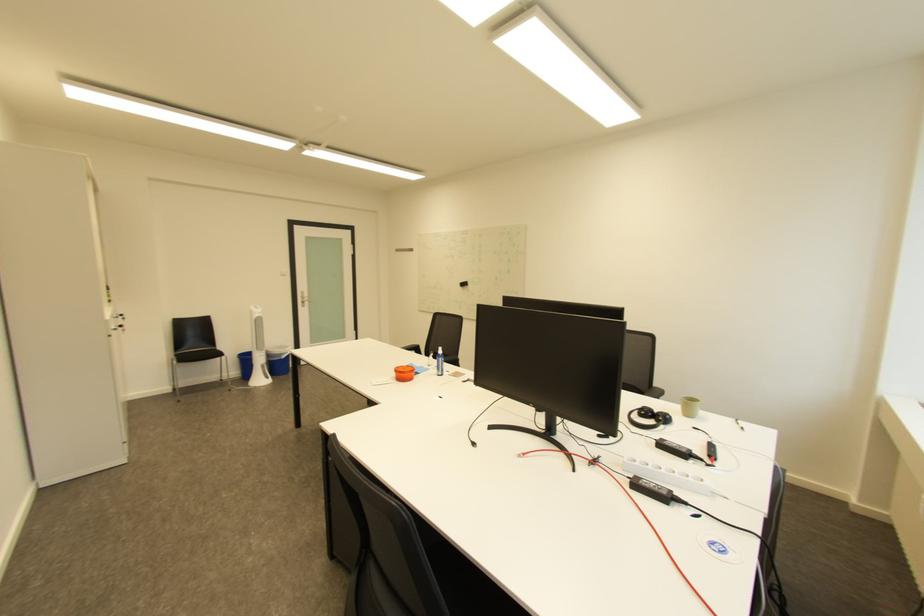
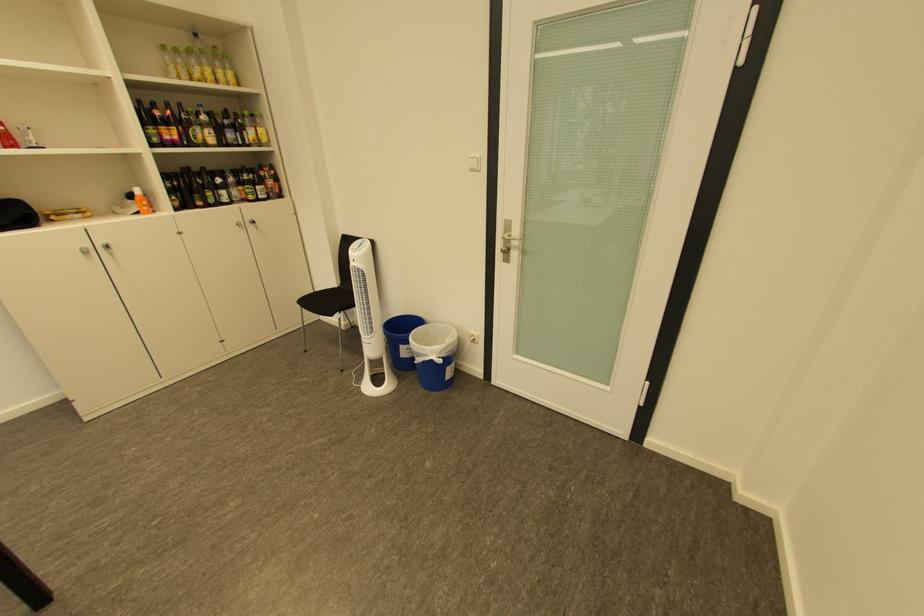
Where in the second image is the point corresponding to (x=293, y=355) from the first image?

(429, 355)